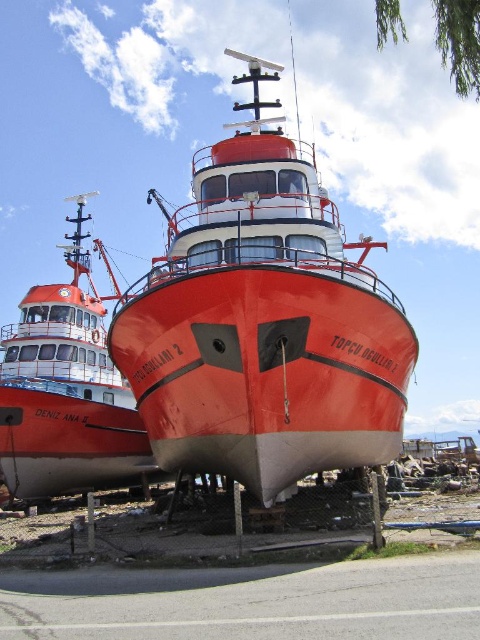
You are a crane operator tasked with lifting a large container onto the shiny red boat at center and the matte red boat at center. Which boat requires the crane to be raised higher to place the container on its deck?

The shiny red boat at center is much taller than the matte red boat at center, so the crane needs to be raised higher to place the container on the shiny red boat at center.

You are a dock worker who needs to load cargo onto both the shiny red boat at center and the matte red boat at center. Which boat should you start with if you want to handle the larger vessel first?

The shiny red boat at center is bigger than the matte red boat at center, so you should start with the shiny red boat at center first.

You are standing on the dock and want to board the shiny red boat at center. If your average walking speed is 1.5 meters per second, how many seconds will it take you to reach the boat?

The shiny red boat at center is 17.04 meters away from the viewer. At a walking speed of 1.5 meters per second, it would take approximately 11.36 seconds to reach the boat.